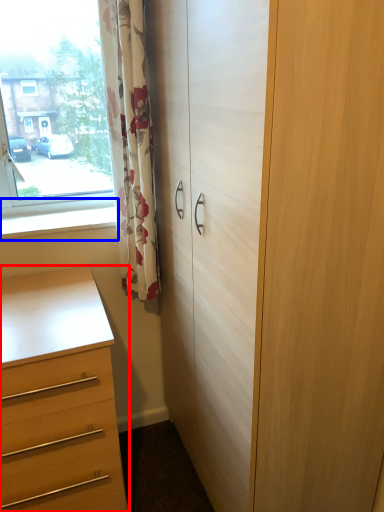
Question: Which object is closer to the camera taking this photo, chest of drawers (highlighted by a red box) or window sill (highlighted by a blue box)?

Choices:
 (A) chest of drawers
 (B) window sill

Answer: (A)